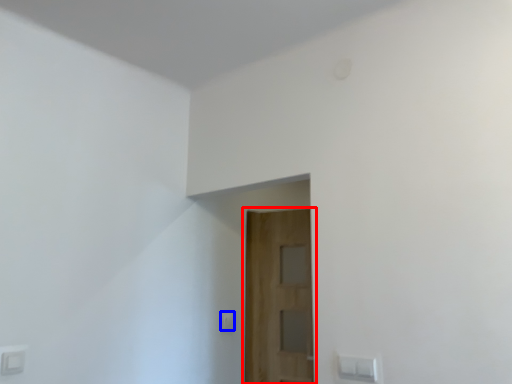
Question: Which object is closer to the camera taking this photo, door (highlighted by a red box) or light switch (highlighted by a blue box)?

Choices:
 (A) door
 (B) light switch

Answer: (A)